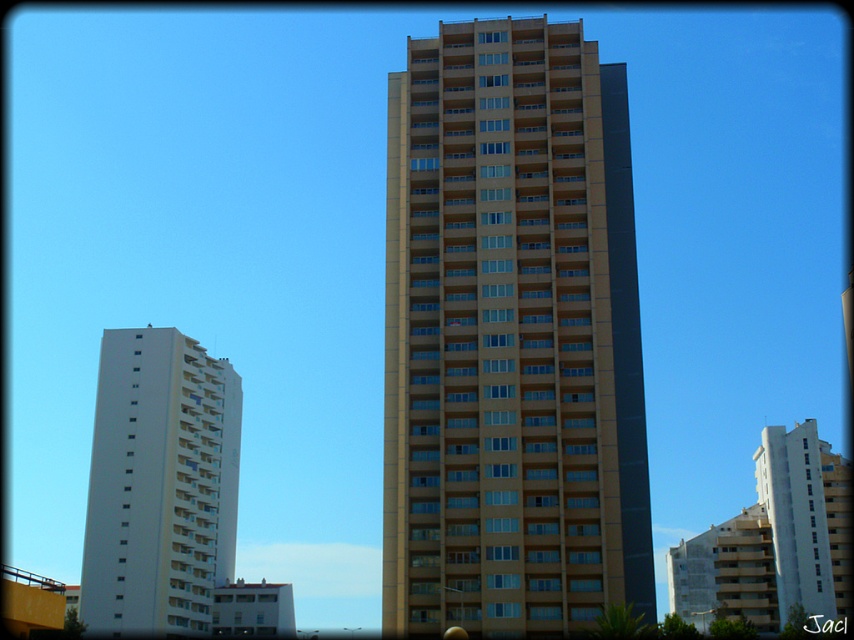
From the picture: Can you confirm if beige concrete building at center is thinner than white smooth building at left?

In fact, beige concrete building at center might be wider than white smooth building at left.

Which of these two, beige concrete building at center or white smooth building at left, stands shorter?

white smooth building at left

Who is more distant from viewer, (x=542, y=129) or (x=120, y=426)?

The point (x=120, y=426) is more distant.

Image resolution: width=854 pixels, height=640 pixels. What are the coordinates of `beige concrete building at center` in the screenshot? It's located at (512, 337).

Who is higher up, beige concrete building at center or white smooth building at center?

beige concrete building at center

Between beige concrete building at center and white smooth building at center, which one appears on the right side from the viewer's perspective?

white smooth building at center is more to the right.

The height and width of the screenshot is (640, 854). I want to click on beige concrete building at center, so click(512, 337).

Find the location of a particular element. This screenshot has height=640, width=854. beige concrete building at center is located at coordinates (512, 337).

Is white smooth building at left below white smooth building at center?

Incorrect, white smooth building at left is not positioned below white smooth building at center.

Who is more forward, (x=209, y=536) or (x=841, y=515)?

Point (x=209, y=536) is in front.

You are a GUI agent. You are given a task and a screenshot of the screen. Output one action in this format:
    pyautogui.click(x=<x>, y=<y>)
    Task: Click on the white smooth building at left
    The image size is (854, 640).
    Given the screenshot: What is the action you would take?
    pyautogui.click(x=159, y=484)